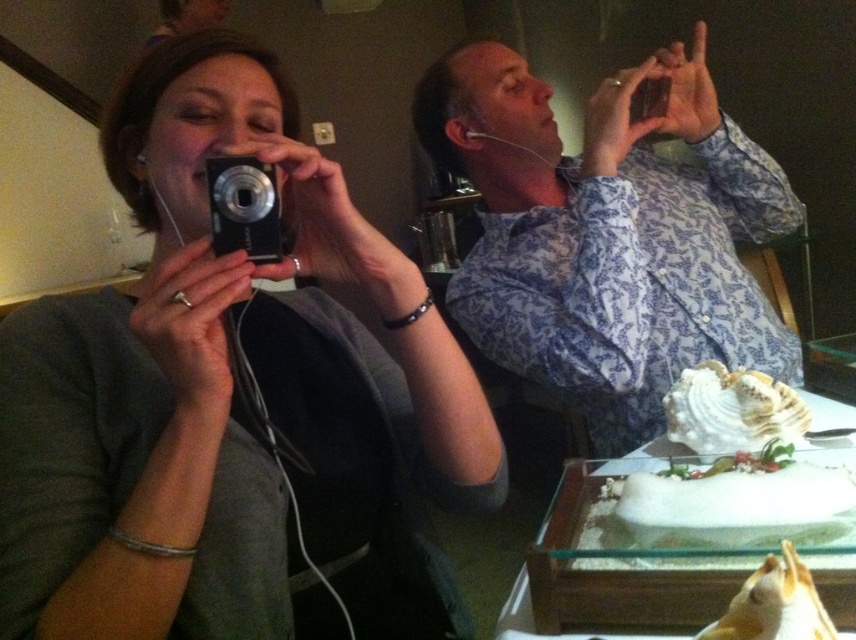
Question: Which of the following is the farthest from the observer?

Choices:
 (A) white frosted cake at center
 (B) matte black camera at upper left

Answer: (A)

Question: Considering the real-world distances, which object is closest to the silver metallic camera at upper center?

Choices:
 (A) matte black camera at upper left
 (B) white frosted cake at center
 (C) blue floral shirt at upper right

Answer: (A)

Question: In this image, where is blue floral shirt at upper right located relative to silver metallic camera at upper center?

Choices:
 (A) below
 (B) above

Answer: (B)

Question: Which object is farther from the camera taking this photo?

Choices:
 (A) white frosted cake at center
 (B) white glossy shell at center
 (C) silver metallic camera at upper center
 (D) matte black camera at upper left

Answer: (B)

Question: Is matte black camera at upper left behind white glossy shell at center?

Choices:
 (A) yes
 (B) no

Answer: (B)

Question: Is the position of white glossy shell at center less distant than that of silver metallic camera at upper center?

Choices:
 (A) no
 (B) yes

Answer: (A)